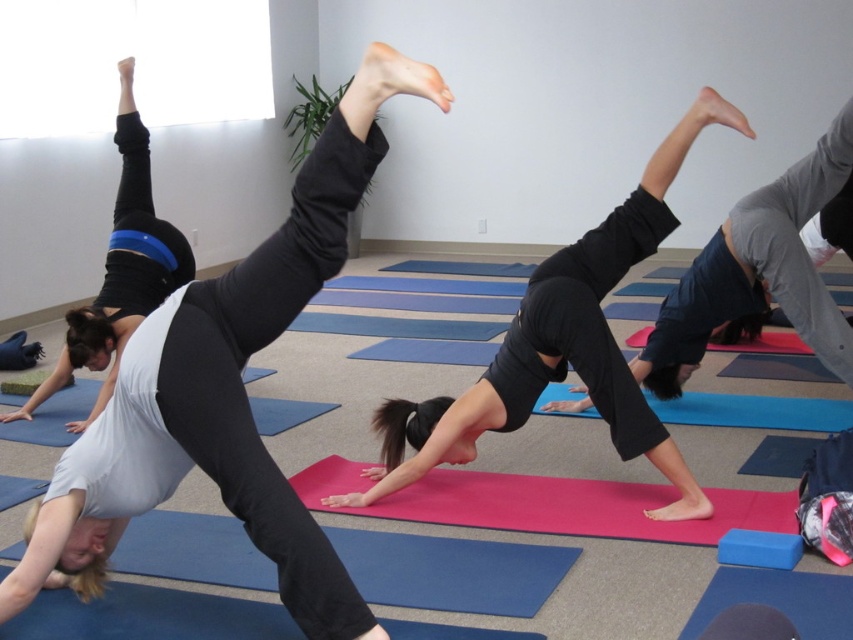
You are a photographer trying to capture a closeup of the black matte yoga pants at center and the pink rubber yoga mat at center. Since the pants are above the mat, will you need to adjust your camera angle upwards or downwards to focus on both?

The black matte yoga pants at center is located above the pink rubber yoga mat at center, so you will need to adjust your camera angle upwards to focus on the black matte yoga pants at center and downwards to focus on the pink rubber yoga mat at center.

You are a photographer trying to capture the yoga session. You want to ensure that the point of interest, which is the matte black leggings at upper center, is centered in your photo. Given that the point of interest is located at coordinates point (224, 390), can you confirm if this point is already centered in the frame?

The point of interest, matte black leggings at upper center, is located at coordinates point (224, 390). To determine if it is centered, the photographer should check if these coordinates align with the frame center. If the frame center is at approximately 0.5, 0.5, then the point is slightly to the right and above the center, so adjustments may be needed.

You are a photographer taking a photo of the yoga class. You notice two sets of matte black leggings at upper center and matte black leggings at center. Which set of leggings appears larger in the photo?

The matte black leggings at upper center appears larger in the photo because it is bigger than the matte black leggings at center.